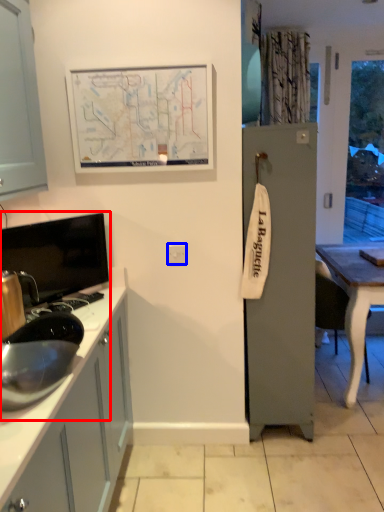
Question: Which point is closer to the camera, sink (highlighted by a red box) or electric outlet (highlighted by a blue box)?

Choices:
 (A) sink
 (B) electric outlet

Answer: (A)